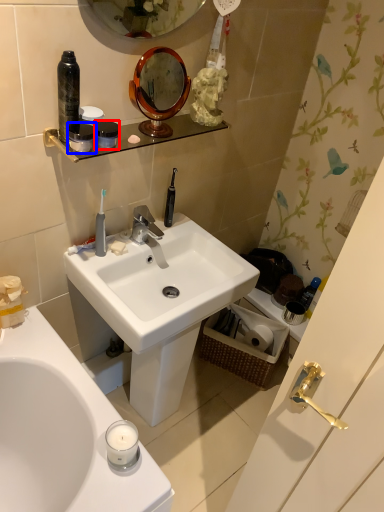
Question: Which object appears farthest to the camera in this image, mouthwash (highlighted by a red box) or mouthwash (highlighted by a blue box)?

Choices:
 (A) mouthwash
 (B) mouthwash

Answer: (A)